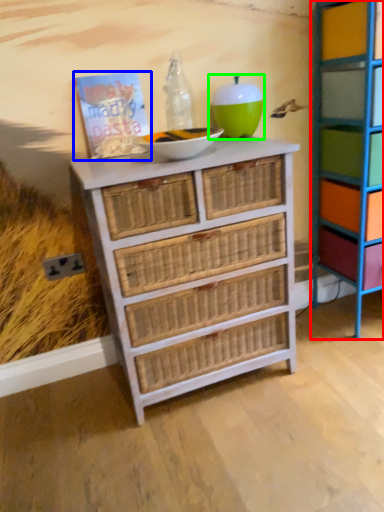
Question: Based on their relative distances, which object is nearer to shelf (highlighted by a red box)? Choose from book (highlighted by a blue box) and turquoise (highlighted by a green box).

Choices:
 (A) book
 (B) turquoise

Answer: (B)